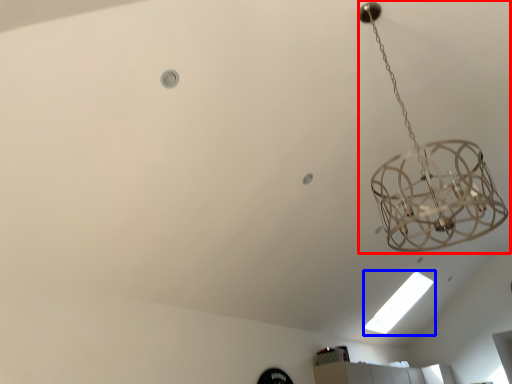
Question: Among these objects, which one is farthest to the camera, lamp (highlighted by a red box) or light bulb (highlighted by a blue box)?

Choices:
 (A) lamp
 (B) light bulb

Answer: (B)